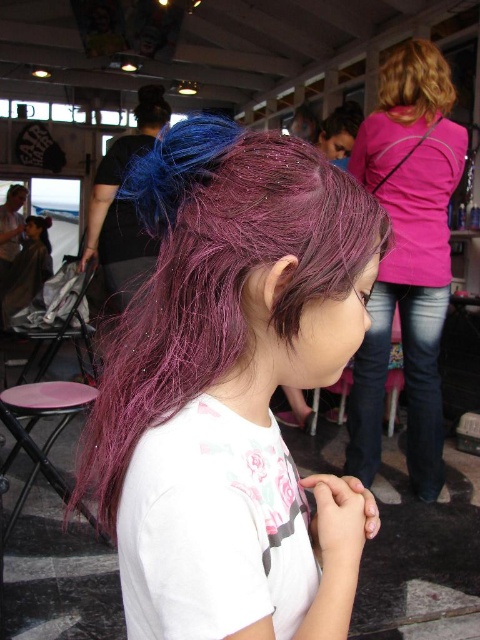
Question: Which point is farther to the camera?

Choices:
 (A) pink plastic stool at lower left
 (B) shiny purple hair at center
 (C) pink fabric shirt at upper right

Answer: (C)

Question: Among these objects, which one is farthest from the camera?

Choices:
 (A) pink fabric shirt at upper right
 (B) blonde curly hair at upper right
 (C) pink plastic stool at lower left
 (D) shiny purple hair at center

Answer: (B)

Question: Does shiny purple hair at center appear on the left side of pink fabric shirt at upper right?

Choices:
 (A) no
 (B) yes

Answer: (B)

Question: Is pink fabric shirt at upper right behind blonde curly hair at upper right?

Choices:
 (A) no
 (B) yes

Answer: (A)

Question: Is pink fabric shirt at upper right positioned behind blonde curly hair at upper right?

Choices:
 (A) yes
 (B) no

Answer: (B)

Question: Among these objects, which one is farthest from the camera?

Choices:
 (A) pink fabric shirt at upper right
 (B) shiny purple hair at center
 (C) pink plastic stool at lower left
 (D) blonde curly hair at upper right

Answer: (D)